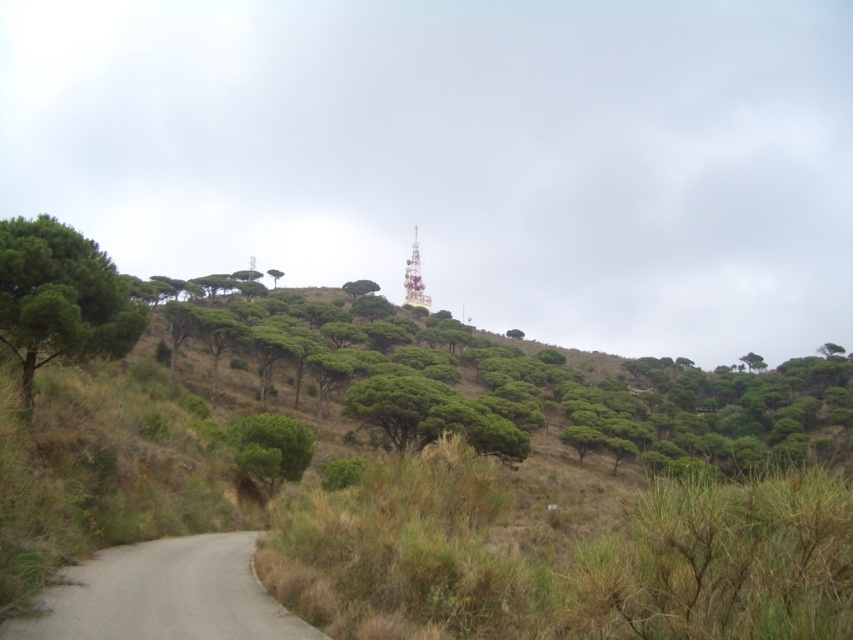
Is green leafy tree at upper center positioned at the back of green leafy tree at left?

That is True.

Can you confirm if green leafy tree at upper center is smaller than green leafy tree at left?

Actually, green leafy tree at upper center might be larger than green leafy tree at left.

You are a GUI agent. You are given a task and a screenshot of the screen. Output one action in this format:
    pyautogui.click(x=<x>, y=<y>)
    Task: Click on the green leafy tree at upper center
    This screenshot has width=853, height=640.
    Given the screenshot: What is the action you would take?
    pyautogui.click(x=540, y=387)

Is point (318, 326) closer to viewer compared to point (271, 276)?

Yes.

Does point (296, 305) come farther from viewer compared to point (276, 273)?

No, (296, 305) is in front of (276, 273).

Between point (799, 376) and point (273, 282), which one is positioned behind?

The point (273, 282) is more distant.

I want to click on green leafy tree at upper center, so click(540, 387).

Which is above, green leafy tree at upper center or gray gravel road at lower left?

green leafy tree at upper center is higher up.

Is green leafy tree at upper center smaller than gray gravel road at lower left?

Actually, green leafy tree at upper center might be larger than gray gravel road at lower left.

You are a GUI agent. You are given a task and a screenshot of the screen. Output one action in this format:
    pyautogui.click(x=<x>, y=<y>)
    Task: Click on the green leafy tree at upper center
    The height and width of the screenshot is (640, 853).
    Given the screenshot: What is the action you would take?
    pyautogui.click(x=540, y=387)